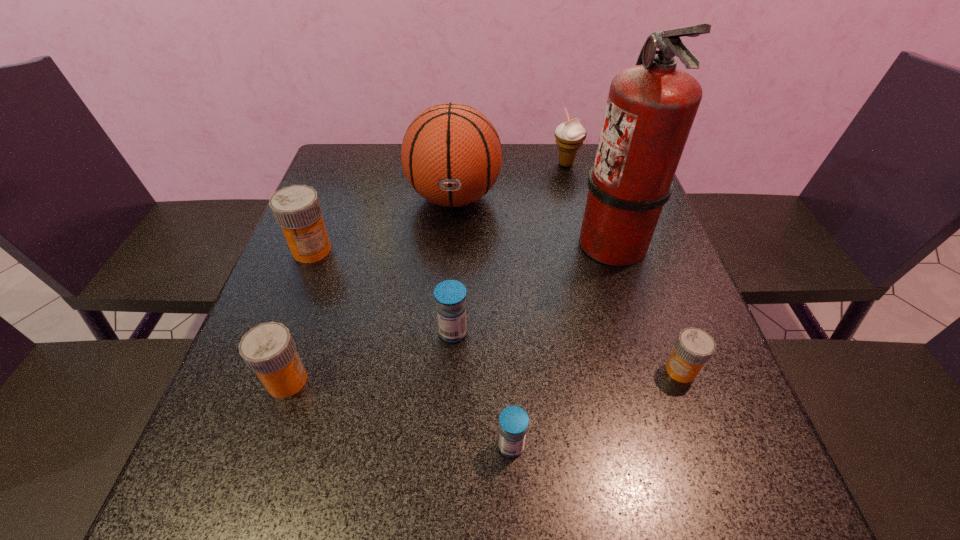
Image resolution: width=960 pixels, height=540 pixels. I want to click on fire extinguisher, so click(651, 107).

What are the coordinates of `red fire extinguisher` in the screenshot? It's located at (651, 107).

The image size is (960, 540). I want to click on the seventh shortest object, so coord(451,154).

This screenshot has height=540, width=960. What are the coordinates of `orange basketball` in the screenshot? It's located at (451, 154).

Where is `icecream`? The image size is (960, 540). icecream is located at coordinates (569, 135).

Where is `the farthest medicine`? the farthest medicine is located at coordinates point(297,210).

The image size is (960, 540). What are the coordinates of `the biggest orange medicine` in the screenshot? It's located at (297, 210).

Locate an element on the screen. the second biggest orange medicine is located at coordinates (269, 350).

The image size is (960, 540). Find the location of `the bigger blue medicine`. the bigger blue medicine is located at coordinates [x=450, y=295].

At what (x,y) coordinates should I click in order to perform the action: click on the fourth nearest object. Please return your answer as a coordinate pair (x, y). The width and height of the screenshot is (960, 540). Looking at the image, I should click on (450, 295).